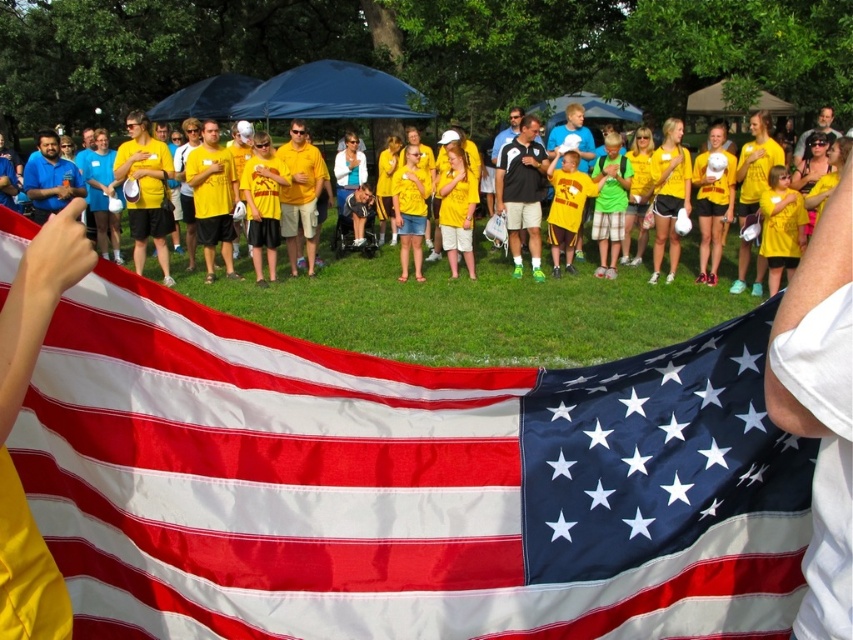
Who is taller, matte fabric flag at center or matte yellow shirt at upper right?

With more height is matte yellow shirt at upper right.

Who is shorter, matte fabric flag at center or matte yellow shirt at upper right?

With less height is matte fabric flag at center.

Is point (302, 540) positioned before point (822, 122)?

Yes, it is in front of point (822, 122).

Image resolution: width=853 pixels, height=640 pixels. What are the coordinates of `matte fabric flag at center` in the screenshot? It's located at (403, 483).

Who is taller, matte fabric flag at center or yellow t-shirt at center?

matte fabric flag at center is taller.

Is matte fabric flag at center positioned before yellow t-shirt at center?

Yes, it is.

Find the location of a particular element. The width and height of the screenshot is (853, 640). matte fabric flag at center is located at coordinates (403, 483).

Does yellow t-shirt at center come in front of matte yellow shirt at upper right?

Yes.

This screenshot has height=640, width=853. What are the coordinates of `yellow t-shirt at center` in the screenshot? It's located at (456, 291).